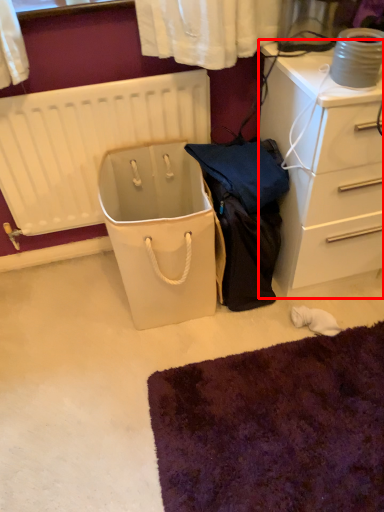
Question: In this image, where is chest of drawers (annotated by the red box) located relative to radiator?

Choices:
 (A) left
 (B) right

Answer: (B)